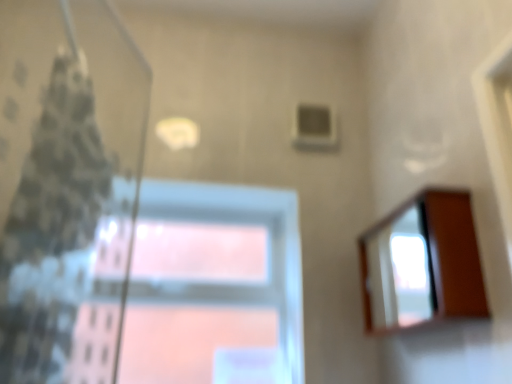
Question: From the image's perspective, is wooden mirror at right located above or below patterned fabric shower curtain at left?

Choices:
 (A) below
 (B) above

Answer: (A)

Question: Relative to patterned fabric shower curtain at left, is wooden mirror at right in front or behind?

Choices:
 (A) behind
 (B) front

Answer: (A)

Question: Which of these objects is positioned farthest from the wooden mirror at right?

Choices:
 (A) transparent glass window at center
 (B) patterned fabric shower curtain at left

Answer: (B)

Question: Considering the real-world distances, which object is farthest from the patterned fabric shower curtain at left?

Choices:
 (A) transparent glass window at center
 (B) wooden mirror at right

Answer: (B)